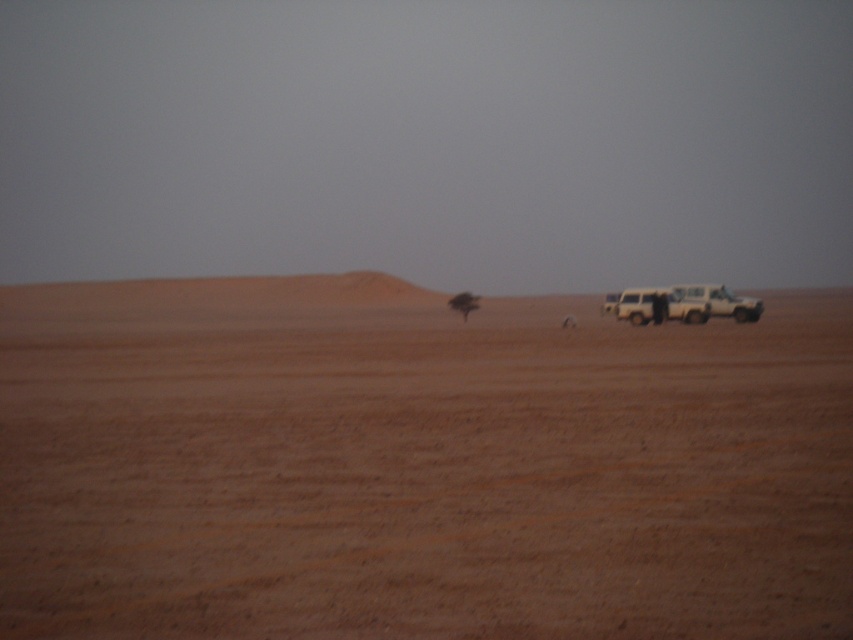
Question: Which point appears closest to the camera in this image?

Choices:
 (A) (570, 518)
 (B) (757, 310)

Answer: (A)

Question: Is brown sandy dirt field at center behind matte white jeep at right?

Choices:
 (A) no
 (B) yes

Answer: (A)

Question: Is brown sandy dirt field at center wider than matte white jeep at right?

Choices:
 (A) yes
 (B) no

Answer: (A)

Question: Considering the relative positions of brown sandy dirt field at center and matte white jeep at right in the image provided, where is brown sandy dirt field at center located with respect to matte white jeep at right?

Choices:
 (A) left
 (B) right

Answer: (A)

Question: Which of the following is the farthest from the observer?

Choices:
 (A) matte white jeep at right
 (B) brown sandy dirt field at center

Answer: (A)